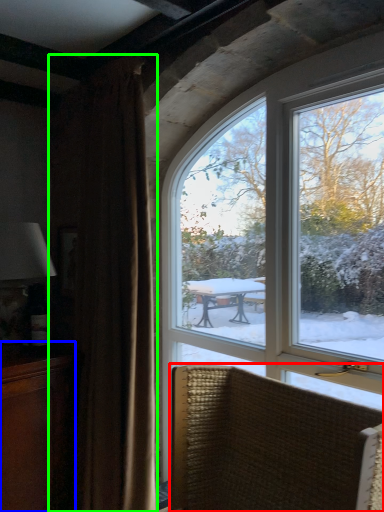
Question: Which object is positioned farthest from chair (highlighted by a red box)? Select from cabinetry (highlighted by a blue box) and curtain (highlighted by a green box).

Choices:
 (A) cabinetry
 (B) curtain

Answer: (A)